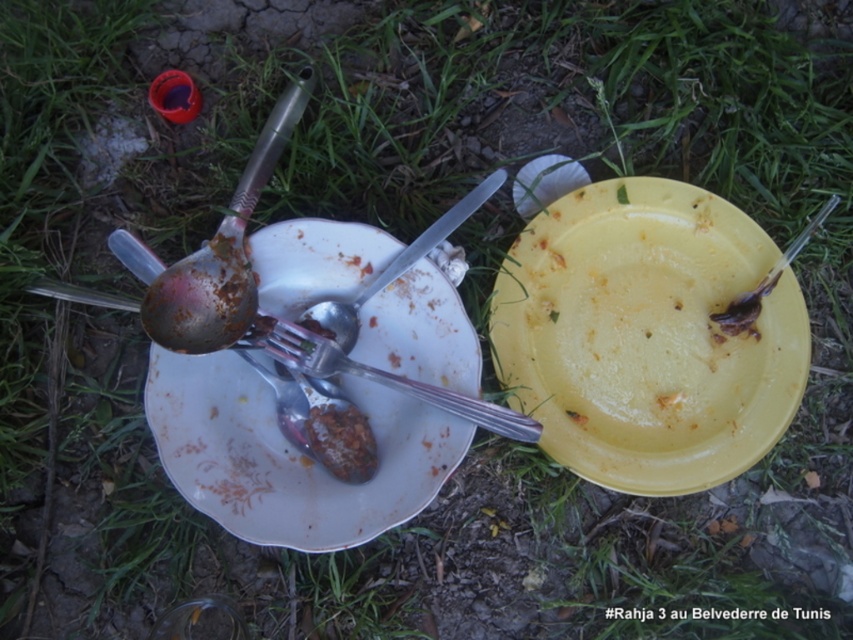
Question: Estimate the real-world distances between objects in this image. Which object is farther from the brown matte food at center?

Choices:
 (A) metallic spoon at right
 (B) silver metallic fork at center

Answer: (A)

Question: Which is farther from the yellow plastic plate at center?

Choices:
 (A) white porcelain plate at center
 (B) silver metallic fork at center
 (C) metallic spoon at right

Answer: (A)

Question: Which object is the farthest from the yellow plastic plate at center?

Choices:
 (A) metallic spoon at right
 (B) silver metallic fork at center

Answer: (B)

Question: Does silver metallic fork at center lie behind brown matte food at center?

Choices:
 (A) no
 (B) yes

Answer: (A)

Question: Can you confirm if white porcelain plate at center is positioned to the left of silver metallic fork at center?

Choices:
 (A) yes
 (B) no

Answer: (A)

Question: Is white porcelain plate at center closer to the viewer compared to metallic spoon at right?

Choices:
 (A) no
 (B) yes

Answer: (B)